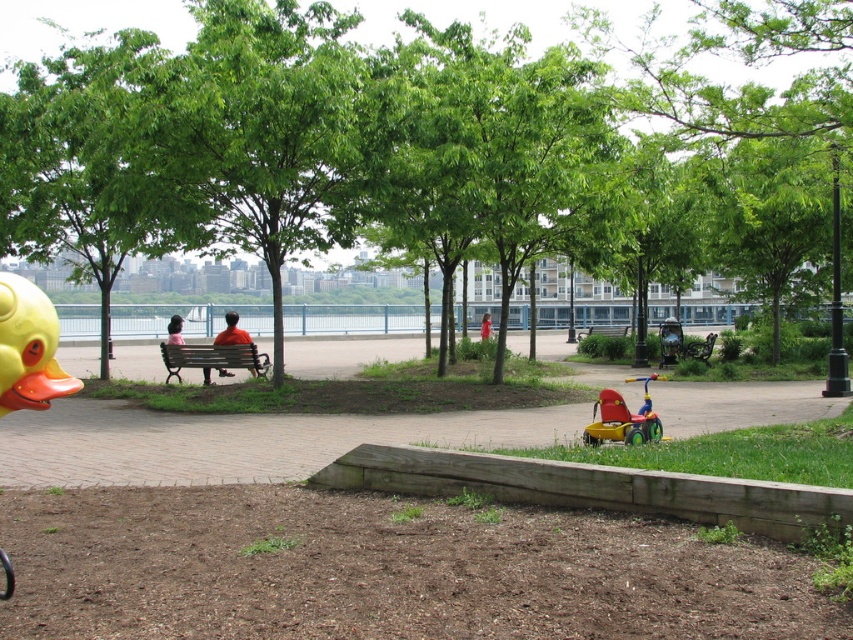
Question: Which object appears farthest from the camera in this image?

Choices:
 (A) orange fabric shirt at center
 (B) red plastic tricycle at lower center

Answer: (A)

Question: Is rubber yellow duck at left behind orange fabric shirt at center?

Choices:
 (A) yes
 (B) no

Answer: (B)

Question: Which object appears farthest from the camera in this image?

Choices:
 (A) rubber yellow duck at left
 (B) wooden bench at center
 (C) red fabric shirt at center

Answer: (C)

Question: Which object is the farthest from the red plastic tricycle at lower center?

Choices:
 (A) green leafy tree at center
 (B) wooden bench at center

Answer: (B)

Question: Can you confirm if rubber yellow duck at left is positioned to the left of wooden bench at center?

Choices:
 (A) no
 (B) yes

Answer: (A)

Question: Is rubber yellow duck at left positioned in front of red plastic tricycle at lower center?

Choices:
 (A) yes
 (B) no

Answer: (A)